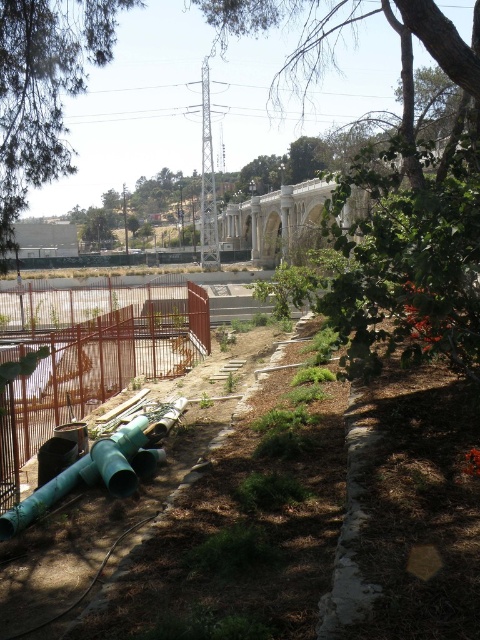
You are standing at the construction site near the bridge and see a point marked at coordinates (394, 188). Which object is this point located on?

The point at (394, 188) is located on the green leafy tree at upper center.

You are standing at the construction site and want to locate two points marked on the ground. The first point is labeled as point (122, 380) and the second is point (116, 461). From your current position, which point is closer to you?

Point (116, 461) is closer to you since it is in front of point (122, 380) according to their spatial arrangement.